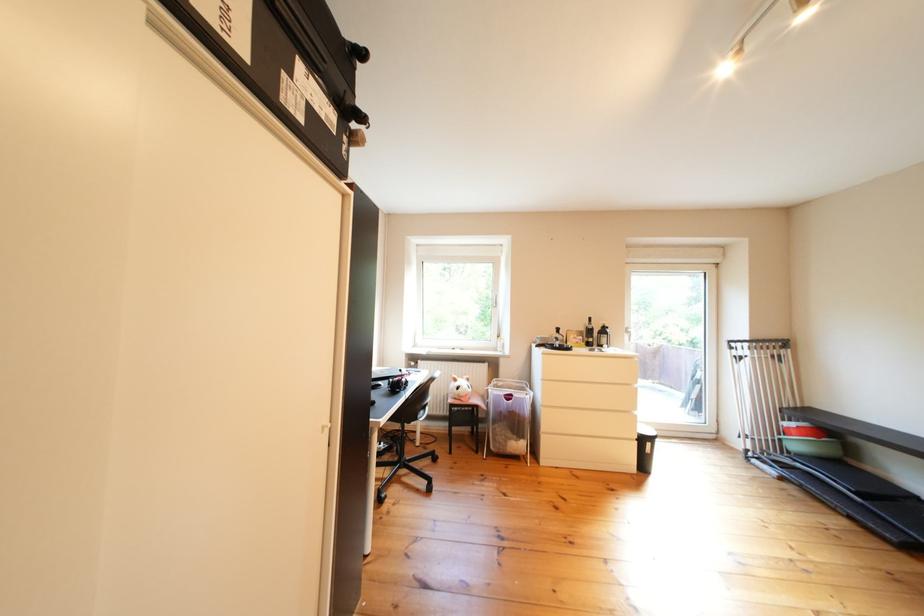
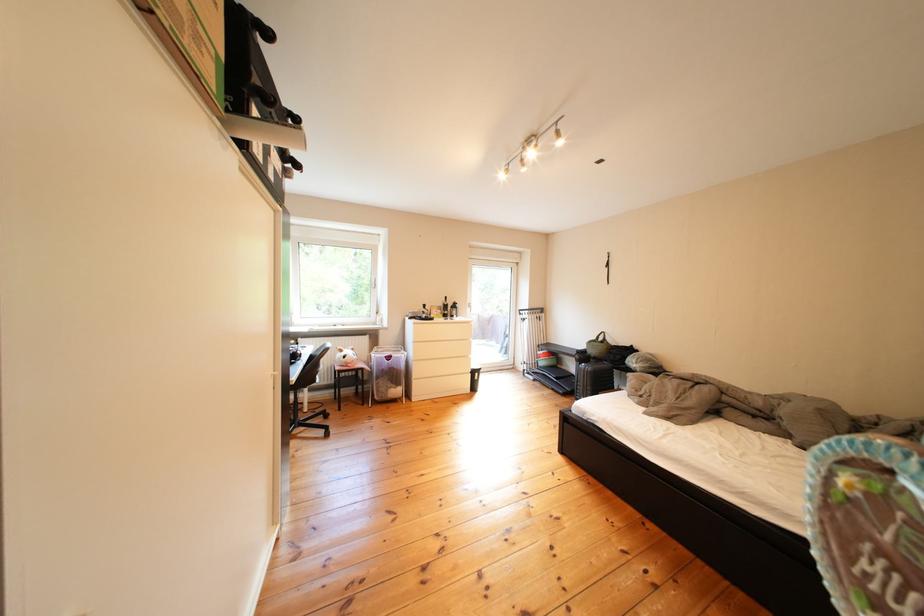
The point at [882,474] is marked in the first image. Where is the corresponding point in the second image?

(578, 371)